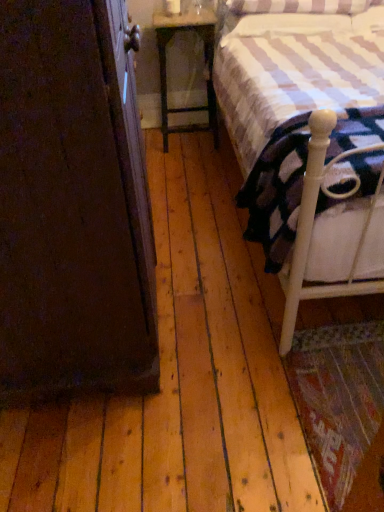
You are a GUI agent. You are given a task and a screenshot of the screen. Output one action in this format:
    pyautogui.click(x=<x>, y=<y>)
    Task: Click on the empty space that is to the right of dark wood armoire at left
    The image size is (384, 512).
    Given the screenshot: What is the action you would take?
    pyautogui.click(x=250, y=315)